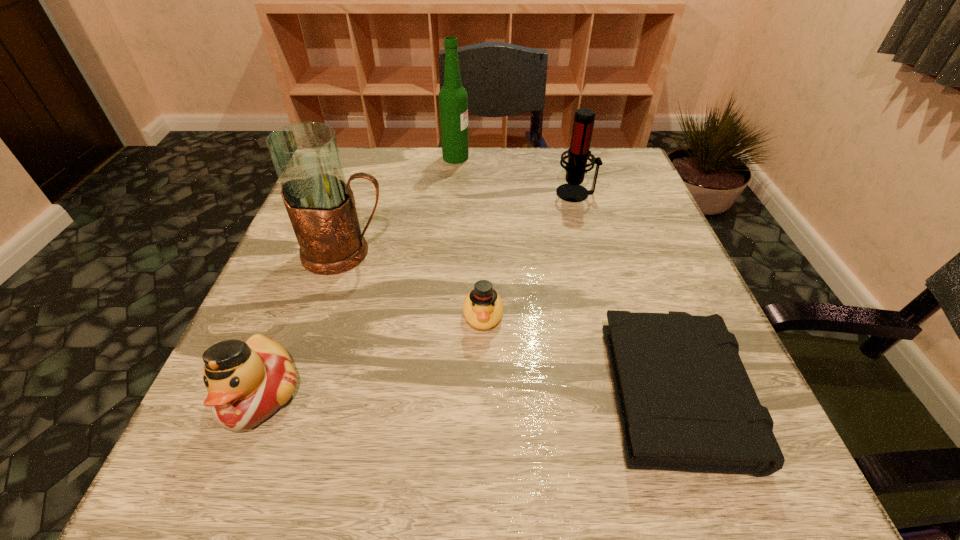
Where is `the farthest object`? This screenshot has height=540, width=960. the farthest object is located at coordinates (453, 99).

Image resolution: width=960 pixels, height=540 pixels. I want to click on the fourth nearest object, so click(319, 201).

Image resolution: width=960 pixels, height=540 pixels. What are the coordinates of `the second tallest object` in the screenshot? It's located at (319, 201).

The height and width of the screenshot is (540, 960). I want to click on the fifth nearest object, so click(578, 153).

Identify the location of microphone. (578, 153).

You are a GUI agent. You are given a task and a screenshot of the screen. Output one action in this format:
    pyautogui.click(x=<x>, y=<y>)
    Task: Click on the third shortest object
    
    Given the screenshot: What is the action you would take?
    pyautogui.click(x=247, y=382)

At what (x,y) coordinates should I click in order to perform the action: click on the left duck. Please return your answer as a coordinate pair (x, y). Image resolution: width=960 pixels, height=540 pixels. Looking at the image, I should click on (247, 382).

Where is `the right duck`? This screenshot has height=540, width=960. the right duck is located at coordinates (483, 308).

Find the location of a particular element. Image resolution: width=960 pixels, height=540 pixels. the shorter duck is located at coordinates (483, 308).

This screenshot has width=960, height=540. Identify the location of Bible. (685, 401).